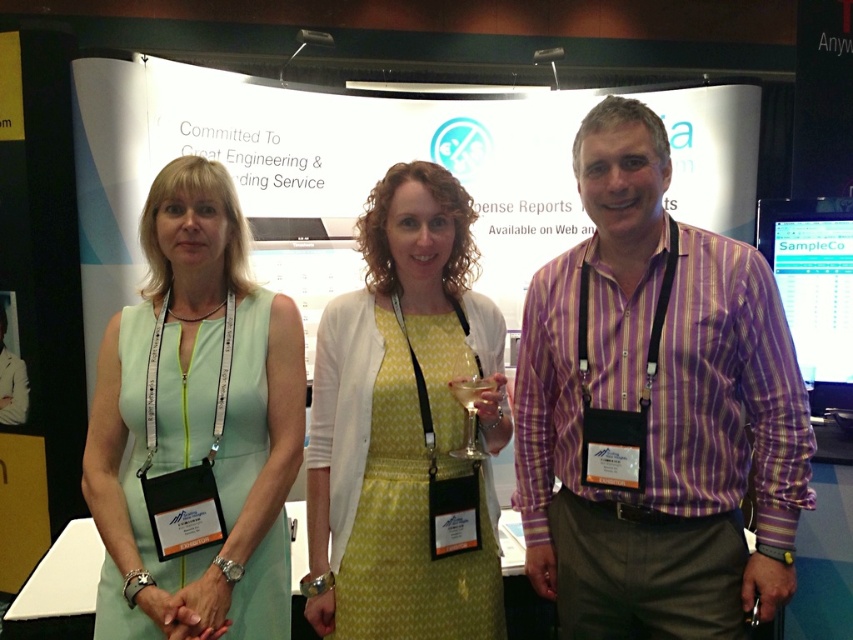
Question: Is yellow dotted dress at center smaller than clear plastic wine glass at center?

Choices:
 (A) yes
 (B) no

Answer: (B)

Question: Does light green fabric dress at left appear on the right side of yellow dotted dress at center?

Choices:
 (A) yes
 (B) no

Answer: (B)

Question: Which object is the closest to the purple striped shirt at center?

Choices:
 (A) light green fabric dress at left
 (B) clear plastic wine glass at center

Answer: (B)

Question: Where is purple striped shirt at center located in relation to yellow dotted dress at center in the image?

Choices:
 (A) left
 (B) right

Answer: (B)

Question: Which object is farther from the camera taking this photo?

Choices:
 (A) yellow dotted dress at center
 (B) purple striped shirt at center
 (C) light green fabric dress at left

Answer: (A)

Question: Which of the following is the farthest from the observer?

Choices:
 (A) light green fabric dress at left
 (B) clear plastic wine glass at center

Answer: (B)